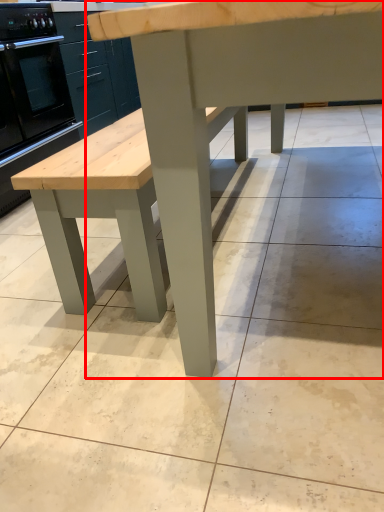
Question: From the image's perspective, what is the correct spatial relationship of table (annotated by the red box) in relation to oven?

Choices:
 (A) below
 (B) above

Answer: (A)